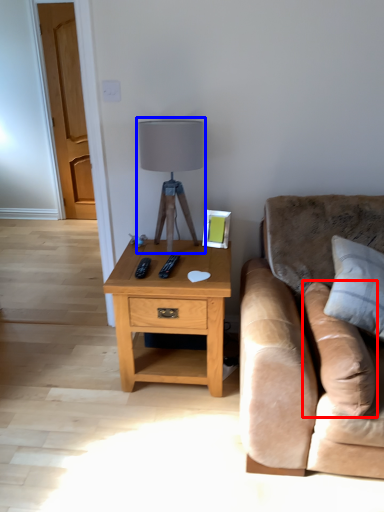
Question: Which object is closer to the camera taking this photo, pillow (highlighted by a red box) or table lamp (highlighted by a blue box)?

Choices:
 (A) pillow
 (B) table lamp

Answer: (A)